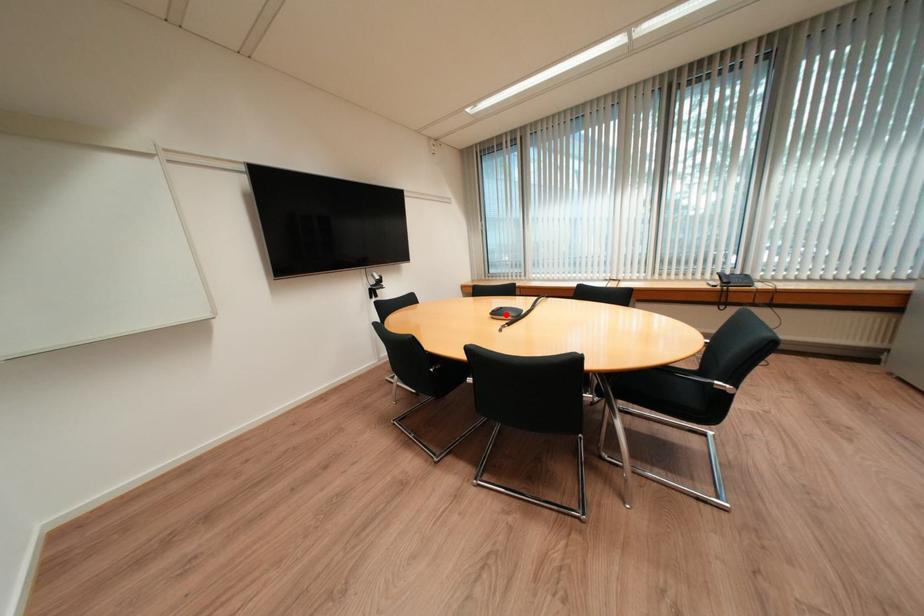
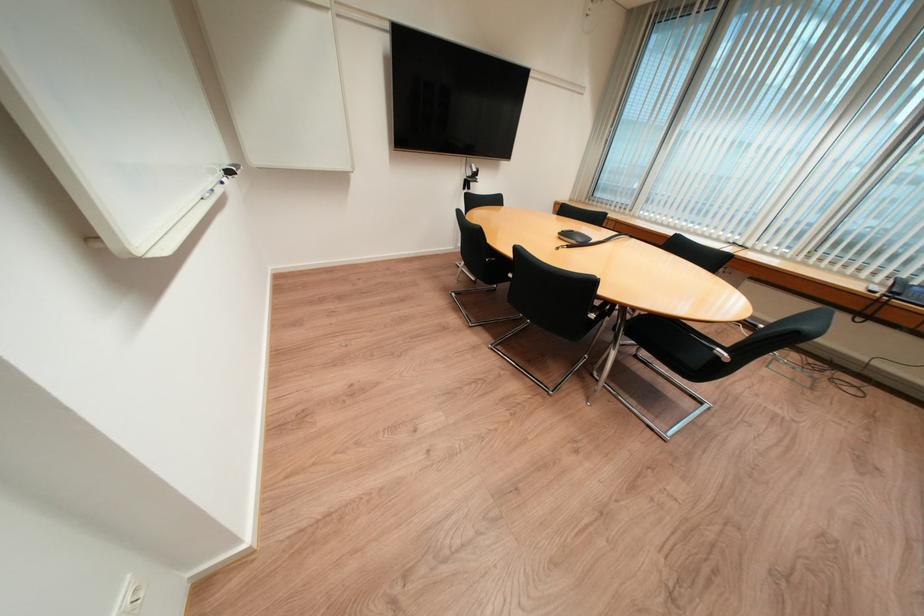
The point at the highlighted location is marked in the first image. Where is the corresponding point in the second image?

(574, 236)